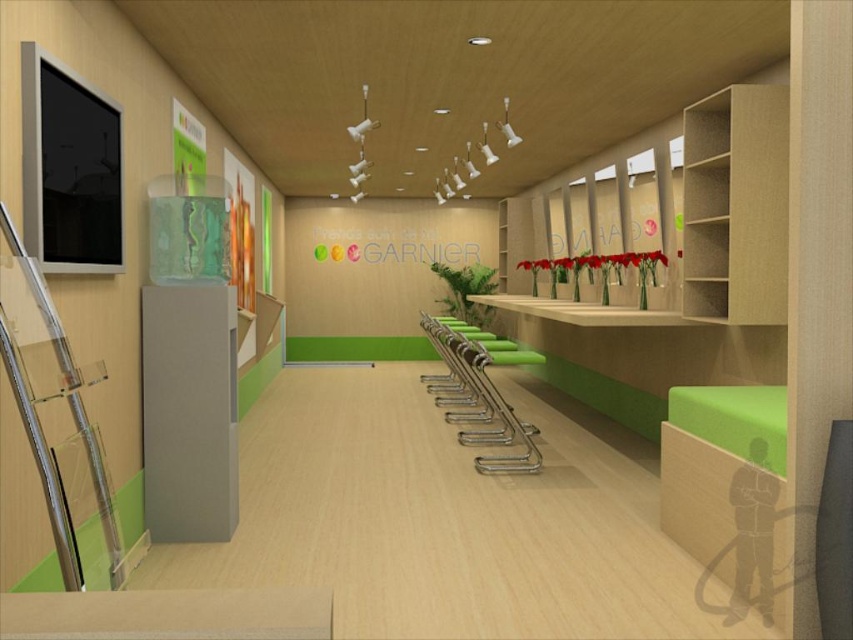
You are designing a layout for a retail store and need to place the clear acrylic ladder at left and the green plastic chair at center. If you want to ensure that the smaller item is placed closer to the entrance, which object should be positioned near the entrance?

The clear acrylic ladder at left is smaller than the green plastic chair at center, so the clear acrylic ladder at left should be positioned near the entrance.

You are an interior designer planning to place a new sofa in this room. You want to ensure that the sofa will fit between the clear acrylic ladder at left and the green plastic chair at center. The sofa you have in mind is 1.2 meters wide. Can you determine if there is enough space between them to accommodate the sofa?

The clear acrylic ladder at left has a lesser width compared to green plastic chair at center. Since the sofa is 1.2 meters wide, the space between them must be at least 1.2 meters. However, without knowing the exact distance between the two objects, we cannot confirm if the sofa will fit. Please measure the space or provide additional details.

You are standing in the room and want to reach a book on a high shelf. The clear acrylic ladder at left is available. Can you safely climb it to reach the book?

The clear acrylic ladder at left is 4.84 feet away from you. Since the distance between you and the ladder is manageable, you can safely move to it and climb to reach the book.